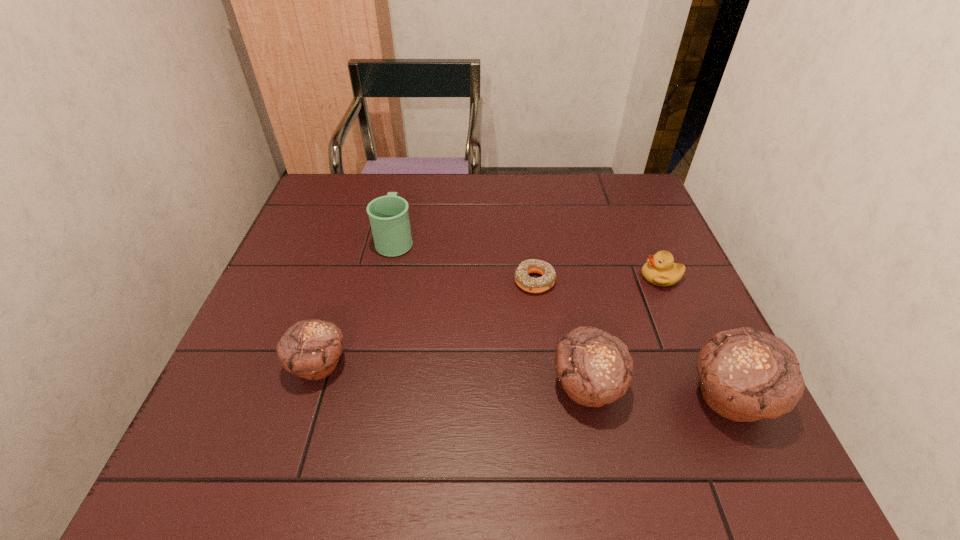
If the aim is uniform spacing by inserting an additional muffin among them, please point to a vacant space for this new muffin. Please provide its 2D coordinates. Your answer should be formatted as a tuple, i.e. [(x, y)], where the tuple contains the x and y coordinates of a point satisfying the conditions above.

[(450, 375)]